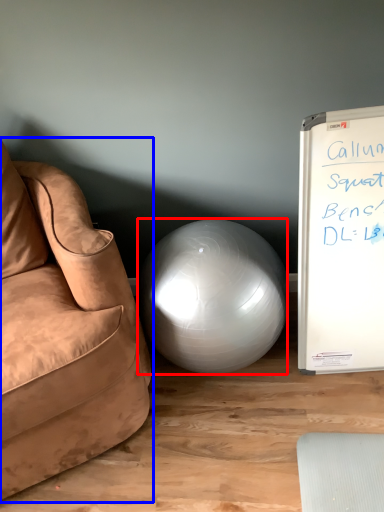
Question: Among these objects, which one is nearest to the camera, ball (highlighted by a red box) or studio couch (highlighted by a blue box)?

Choices:
 (A) ball
 (B) studio couch

Answer: (B)